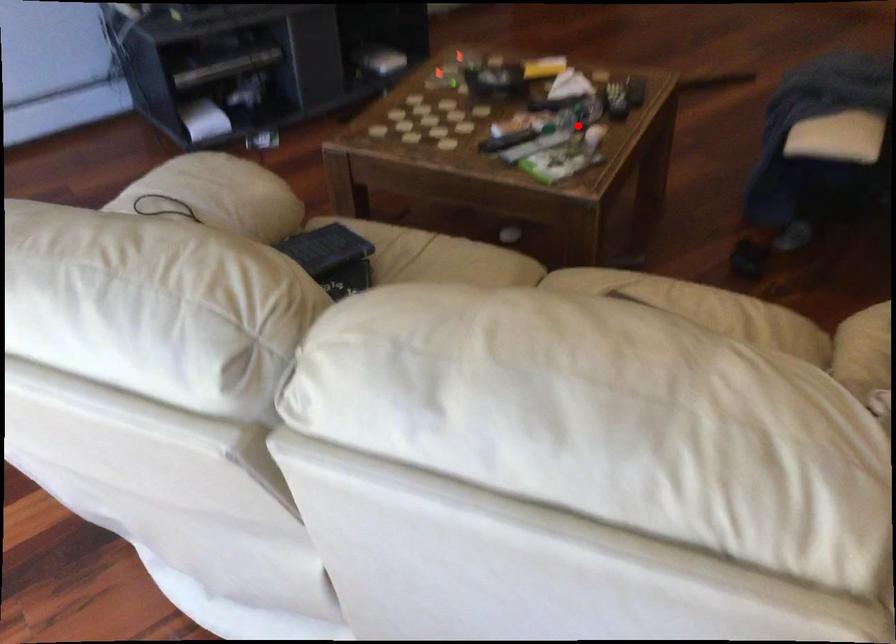
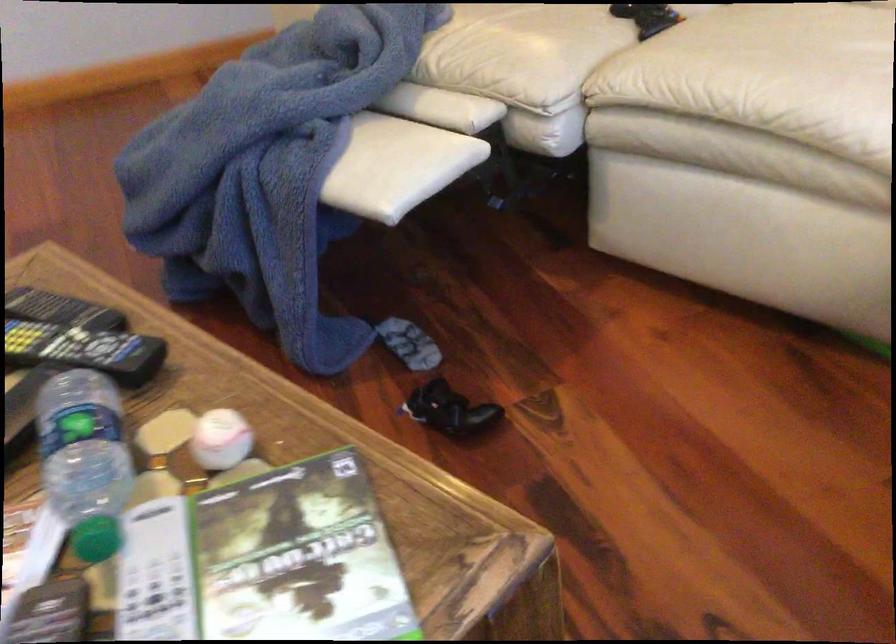
In the second image, find the point that corresponds to the highlighted location in the first image.

(220, 439)